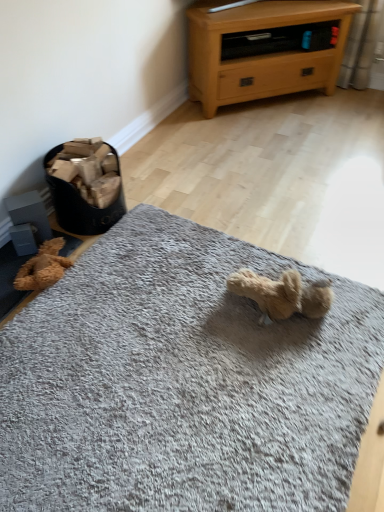
Locate an element on the screen. The width and height of the screenshot is (384, 512). free space in front of brown plush teddy bear at lower left is located at coordinates (x=46, y=318).